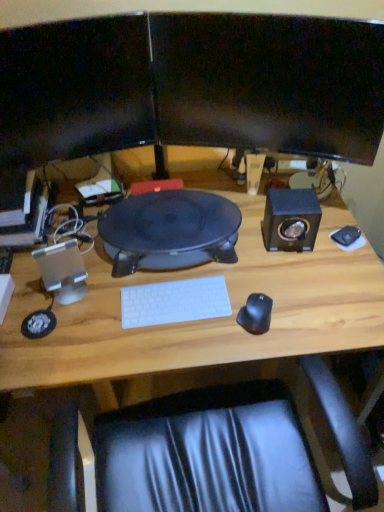
Find the location of a particular element. This screenshot has height=512, width=384. free location to the right of matte black speaker at center is located at coordinates (290, 253).